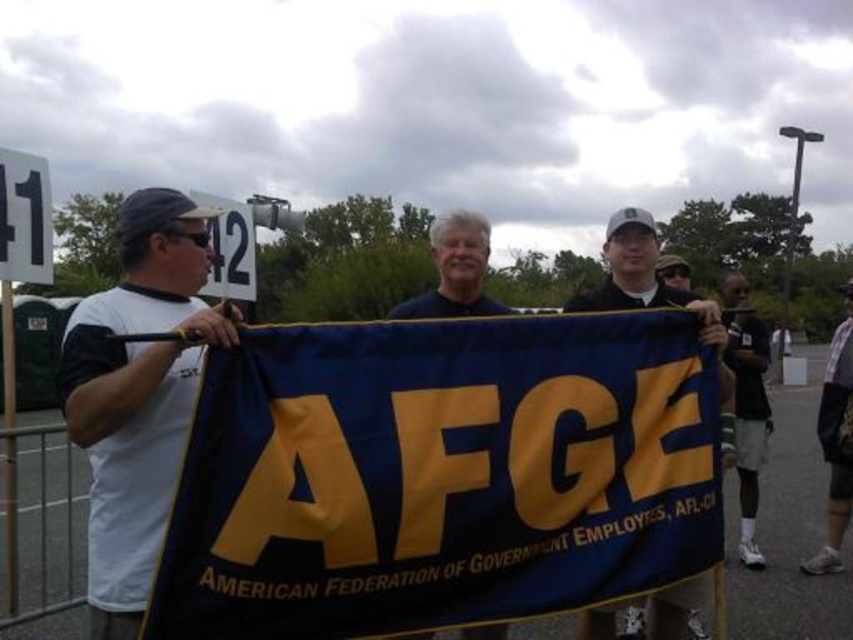
Between dark blue jersey at right and white plastic sign at upper center, which one has more height?

With more height is dark blue jersey at right.

Is dark blue jersey at right positioned behind white plastic sign at upper center?

That is False.

What do you see at coordinates (746, 404) in the screenshot?
I see `dark blue jersey at right` at bounding box center [746, 404].

At what (x,y) coordinates should I click in order to perform the action: click on dark blue jersey at right. Please return your answer as a coordinate pair (x, y). Looking at the image, I should click on (746, 404).

Is blue/yellow fabric banner at center to the left of black plastic sign at left from the viewer's perspective?

Incorrect, blue/yellow fabric banner at center is not on the left side of black plastic sign at left.

Is blue/yellow fabric banner at center below black plastic sign at left?

Indeed, blue/yellow fabric banner at center is positioned under black plastic sign at left.

Which is in front, point (293, 348) or point (18, 221)?

Point (293, 348) is more forward.

You are a GUI agent. You are given a task and a screenshot of the screen. Output one action in this format:
    pyautogui.click(x=<x>, y=<y>)
    Task: Click on the blue/yellow fabric banner at center
    This screenshot has height=640, width=853.
    Given the screenshot: What is the action you would take?
    440,474

Is black plastic sign at left smaller than white plastic sign at upper center?

Yes, black plastic sign at left is smaller than white plastic sign at upper center.

Can you confirm if black plastic sign at left is thinner than white plastic sign at upper center?

No.

Does point (42, 196) come closer to viewer compared to point (212, 236)?

Yes, point (42, 196) is in front of point (212, 236).

What are the coordinates of `black plastic sign at left` in the screenshot? It's located at (24, 218).